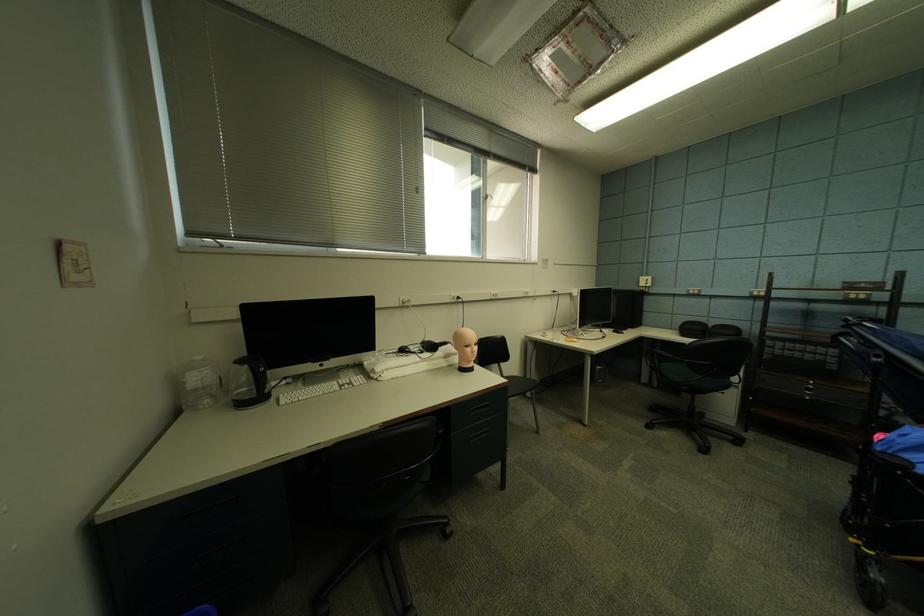
Find where to sit the chair sitting surface. Please return your answer as a coordinate pair (x, y).

(518, 385)